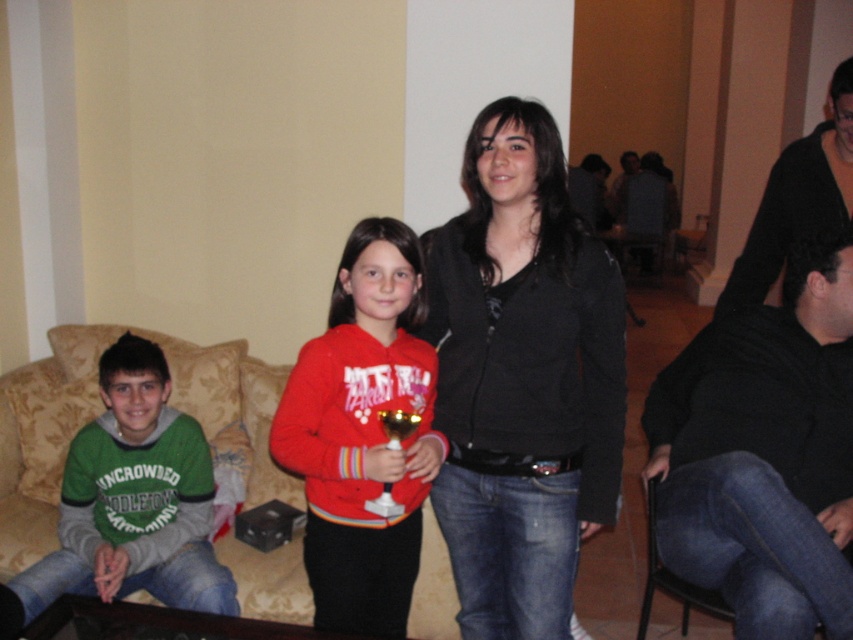
Question: Can you confirm if matte red hoodie at center is positioned to the left of green fleece sweatshirt at left?

Choices:
 (A) no
 (B) yes

Answer: (A)

Question: Does black matte jacket at center have a smaller size compared to green fleece sweatshirt at left?

Choices:
 (A) yes
 (B) no

Answer: (B)

Question: Which point is farther to the camera?

Choices:
 (A) matte red hoodie at center
 (B) gold metallic trophy at center
 (C) black matte jacket at center

Answer: (C)

Question: Based on their relative distances, which object is nearer to the green fleece sweatshirt at left?

Choices:
 (A) gold metallic trophy at center
 (B) beige fabric couch at lower left
 (C) black matte jacket at center
 (D) matte red hoodie at center

Answer: (B)

Question: Is black matte jacket at center smaller than gold metallic trophy at center?

Choices:
 (A) yes
 (B) no

Answer: (B)

Question: Estimate the real-world distances between objects in this image. Which object is closer to the matte red hoodie at center?

Choices:
 (A) green fleece sweatshirt at left
 (B) gold metallic trophy at center
 (C) black matte jacket at center
 (D) beige fabric couch at lower left

Answer: (B)